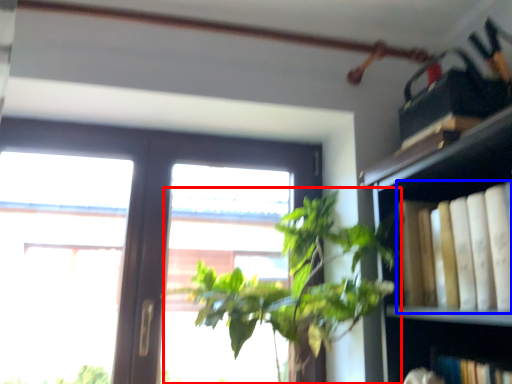
Question: Which object is further to the camera taking this photo, houseplant (highlighted by a red box) or book (highlighted by a blue box)?

Choices:
 (A) houseplant
 (B) book

Answer: (A)